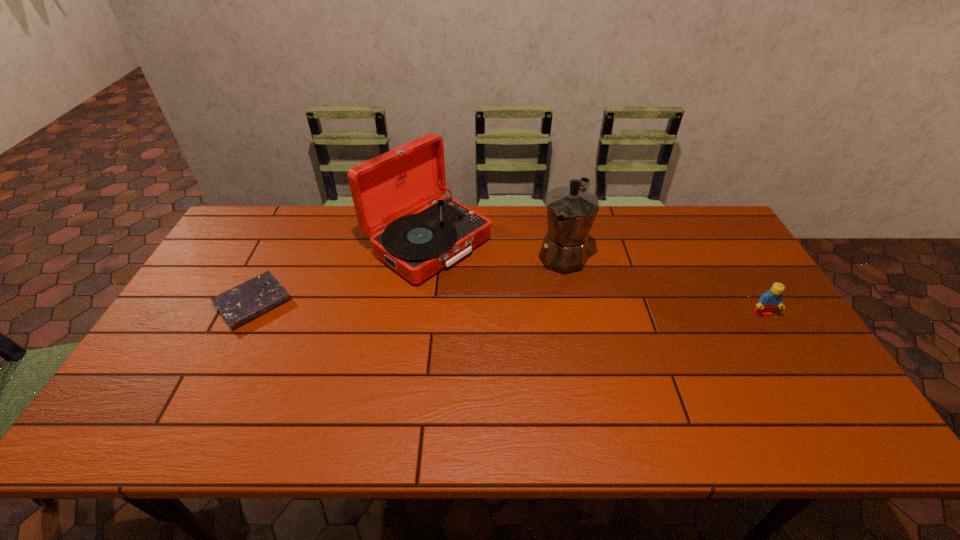
Identify the location of free space between the shortest object and the third tallest object. This screenshot has width=960, height=540. (508, 308).

Where is `blank region between the second shortest object and the coffeepot`? Image resolution: width=960 pixels, height=540 pixels. blank region between the second shortest object and the coffeepot is located at coordinates (662, 284).

This screenshot has width=960, height=540. Find the location of `vacant point located between the second object from left to right and the Lego`. vacant point located between the second object from left to right and the Lego is located at coordinates (595, 279).

The height and width of the screenshot is (540, 960). What are the coordinates of `free space between the third tallest object and the coffeepot` in the screenshot? It's located at (662, 284).

Select which object is the third closest to the coffeepot. Please provide its 2D coordinates. Your answer should be formatted as a tuple, i.e. [(x, y)], where the tuple contains the x and y coordinates of a point satisfying the conditions above.

[(239, 305)]

Find the location of a particular element. This screenshot has width=960, height=540. the third closest object to the leftmost object is located at coordinates (768, 301).

Locate an element on the screen. vacant region that satisfies the following two spatial constraints: 1. on the back side of the leftmost object; 2. on the right side of the third object from right to left is located at coordinates (283, 243).

The height and width of the screenshot is (540, 960). What are the coordinates of `vacant point that satisfies the following two spatial constraints: 1. on the back side of the shortest object; 2. on the right side of the phonograph_record` in the screenshot? It's located at (283, 243).